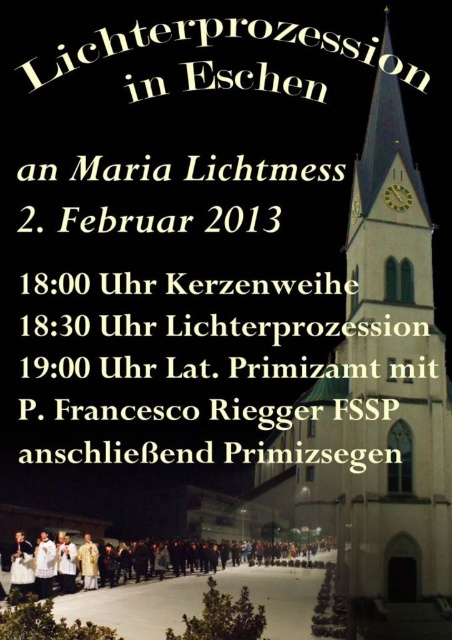
Question: Is white clothed people at center below white satin dress at lower center?

Choices:
 (A) yes
 (B) no

Answer: (A)

Question: Which is farther from the matte gold robe at center?

Choices:
 (A) white stone church at center
 (B) white satin dress at lower center
 (C) white clothed people at center

Answer: (A)

Question: Is white clothed people at center above white satin dress at lower center?

Choices:
 (A) no
 (B) yes

Answer: (A)

Question: Based on their relative distances, which object is farther from the white stone church at center?

Choices:
 (A) white satin dress at lower center
 (B) matte gold robe at center
 (C) white clothed people at center

Answer: (A)

Question: Which point is closer to the camera taking this photo?

Choices:
 (A) (86, 573)
 (B) (23, 592)
 (C) (300, 513)

Answer: (C)

Question: Is white clothed people at center positioned behind white satin dress at lower center?

Choices:
 (A) no
 (B) yes

Answer: (A)